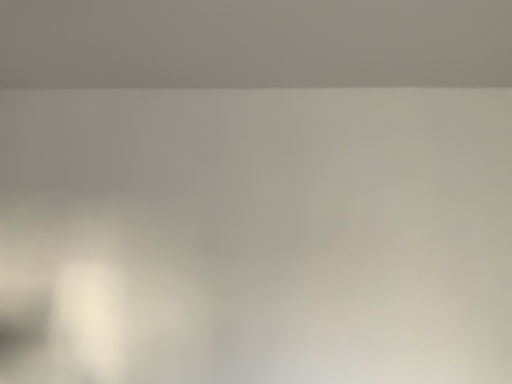
Measure the distance between point (37, 0) and camera.

A distance of 1.59 meters exists between point (37, 0) and camera.

What are the coordinates of `white matte wall at upper center` in the screenshot? It's located at (254, 43).

In order to face white matte wall at upper center, should I rotate leftwards or rightwards?

It's best to rotate left around 1.070 degrees.

The height and width of the screenshot is (384, 512). Describe the element at coordinates (254, 43) in the screenshot. I see `white matte wall at upper center` at that location.

The image size is (512, 384). In order to click on white matte wall at upper center in this screenshot , I will do [x=254, y=43].